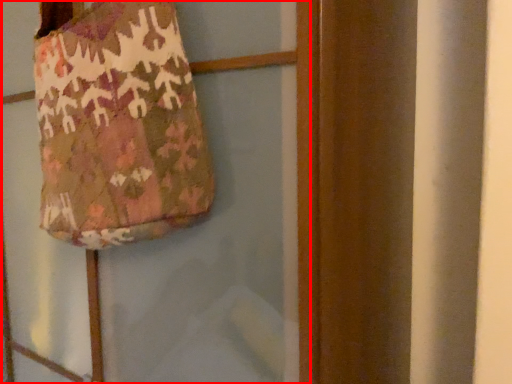
Question: Where is screen door (annotated by the red box) located in relation to handbag in the image?

Choices:
 (A) right
 (B) left

Answer: (A)